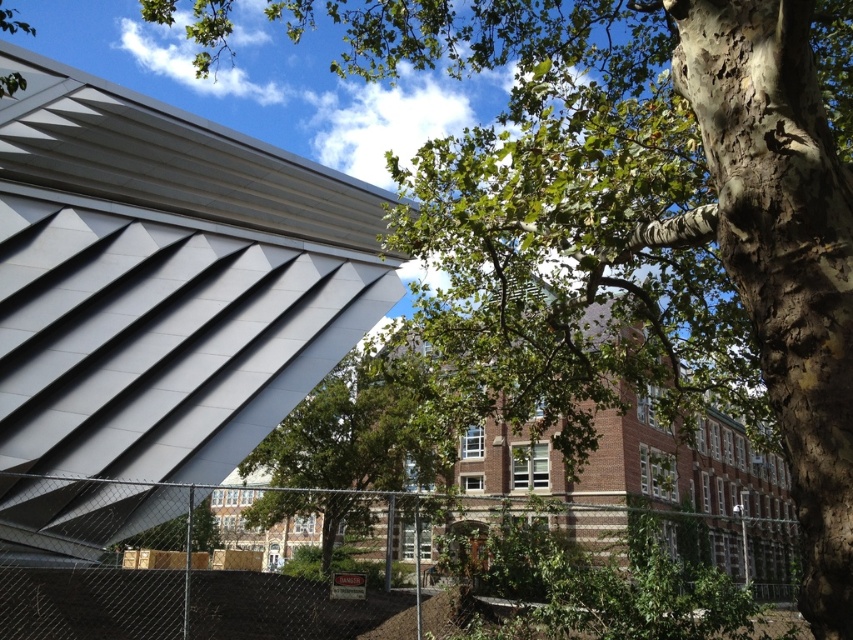
Question: Estimate the real-world distances between objects in this image. Which object is closer to the metallic silver roof at upper left?

Choices:
 (A) green chain-link fence at center
 (B) green leafy tree at center

Answer: (A)

Question: Is green chain-link fence at center smaller than green leafy tree at center?

Choices:
 (A) yes
 (B) no

Answer: (B)

Question: Can you confirm if green chain-link fence at center is smaller than green leafy tree at center?

Choices:
 (A) no
 (B) yes

Answer: (A)

Question: Based on their relative distances, which object is farther from the green chain-link fence at center?

Choices:
 (A) metallic silver roof at upper left
 (B) green leafy tree at center

Answer: (A)

Question: Is metallic silver roof at upper left behind green leafy tree at center?

Choices:
 (A) yes
 (B) no

Answer: (A)

Question: Which is nearer to the green leafy tree at center?

Choices:
 (A) green chain-link fence at center
 (B) metallic silver roof at upper left

Answer: (A)